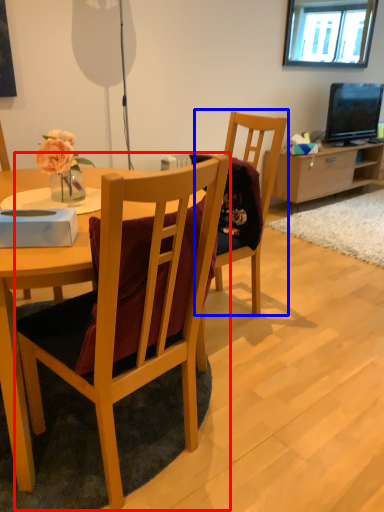
Question: Which object appears farthest to the camera in this image, chair (highlighted by a red box) or armchair (highlighted by a blue box)?

Choices:
 (A) chair
 (B) armchair

Answer: (B)